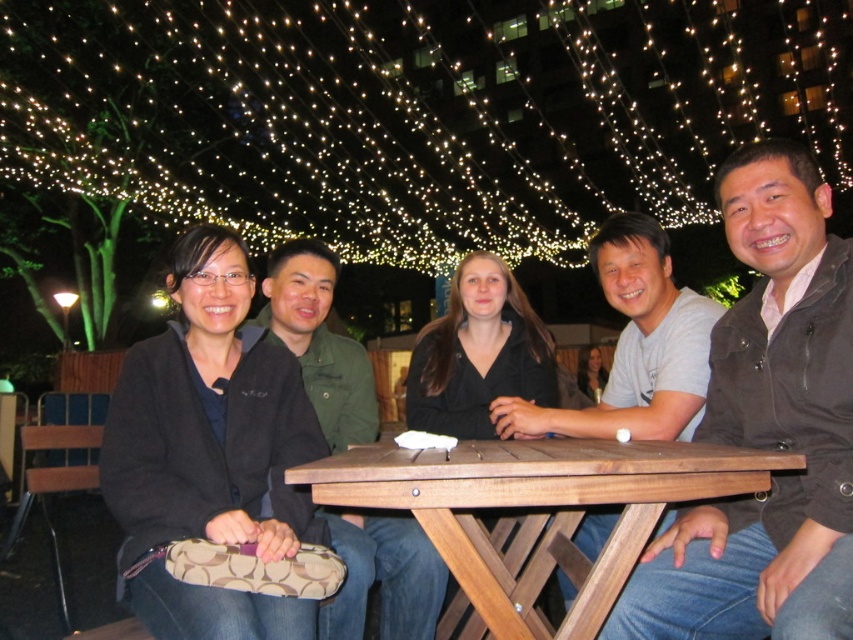
Is black fuzzy sweater at left above wooden table at center?

Indeed, black fuzzy sweater at left is positioned over wooden table at center.

Where is `black fuzzy sweater at left`? Image resolution: width=853 pixels, height=640 pixels. black fuzzy sweater at left is located at coordinates (210, 451).

Can you confirm if brown leather jacket at right is positioned below wooden table at center?

Actually, brown leather jacket at right is above wooden table at center.

How far apart are brown leather jacket at right and wooden table at center?

brown leather jacket at right is 13.38 inches from wooden table at center.

Where is `brown leather jacket at right`? The image size is (853, 640). brown leather jacket at right is located at coordinates (766, 429).

Does brown leather jacket at right have a lesser height compared to black fuzzy sweater at left?

No, brown leather jacket at right is not shorter than black fuzzy sweater at left.

Between brown leather jacket at right and black fuzzy sweater at left, which one appears on the right side from the viewer's perspective?

From the viewer's perspective, brown leather jacket at right appears more on the right side.

Does point (828, 556) lie behind point (296, 540)?

No, it is in front of (296, 540).

The width and height of the screenshot is (853, 640). Identify the location of brown leather jacket at right. (766, 429).